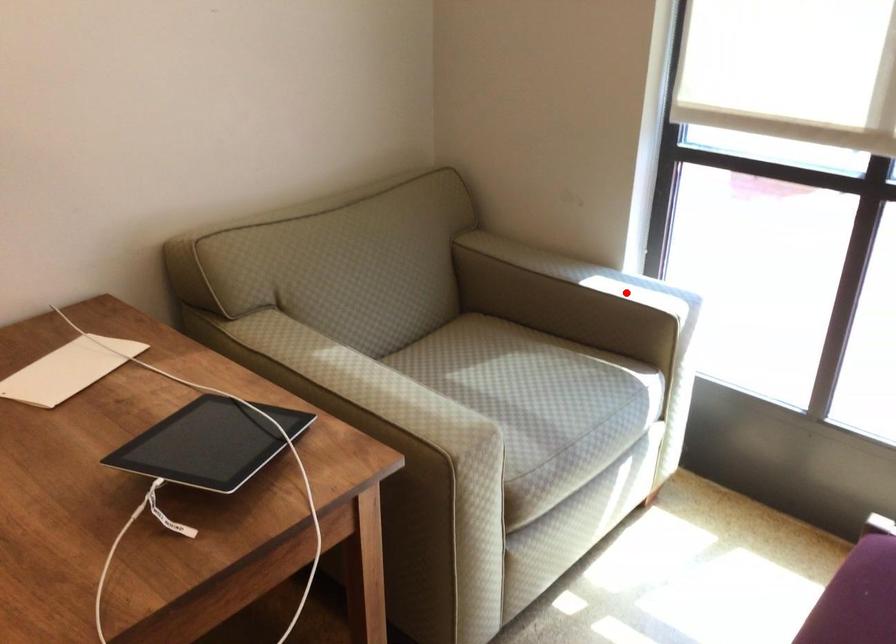
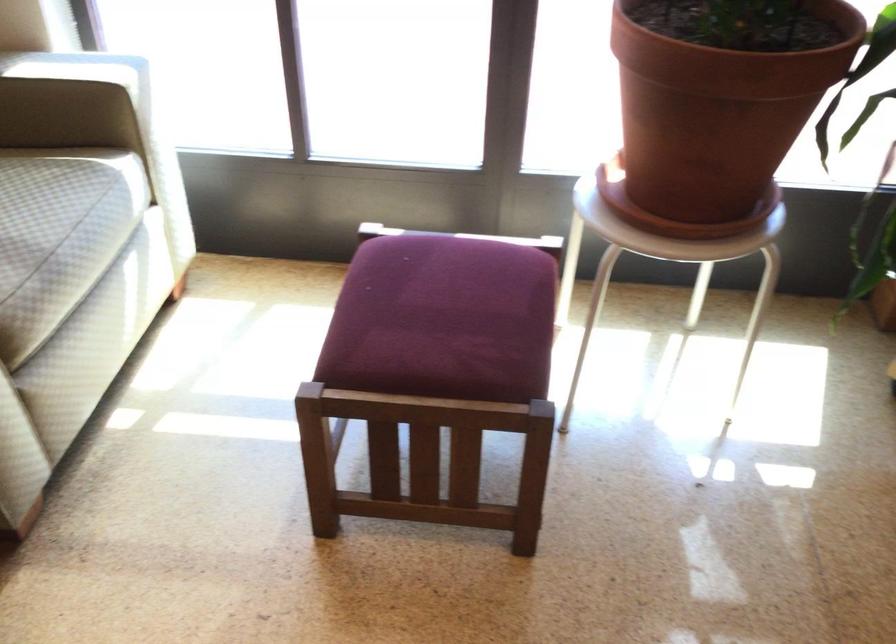
Question: I am providing you with two images of the same scene from different viewpoints. Given a red point in image1, look at the same physical point in image2. Is it:

Choices:
 (A) Closer to the viewpoint
 (B) Farther from the viewpoint

Answer: (A)